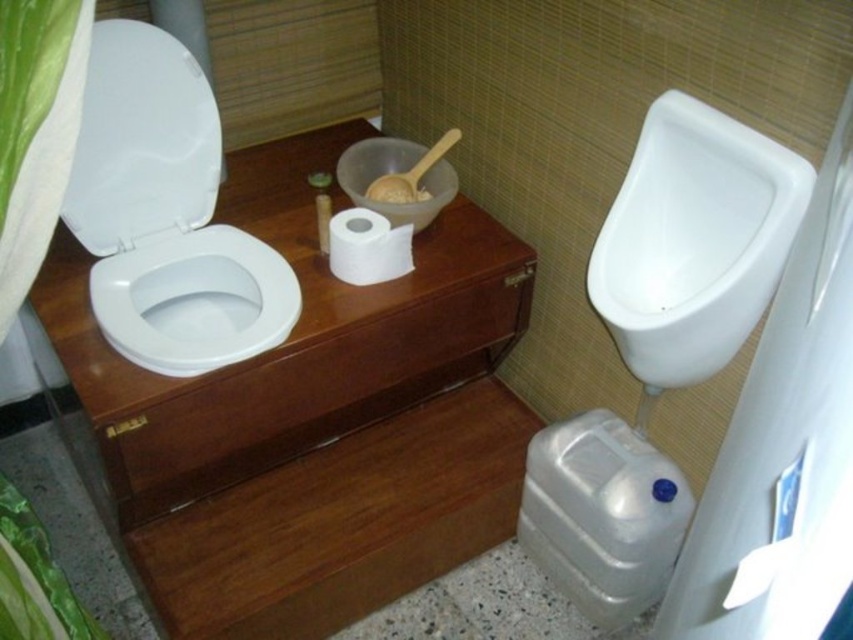
In the scene shown: You are designing a bathroom layout and need to place a decorative plant between the white glossy toilet lid at upper left and the white matte bowl at center. Which object should the plant be closer to if you want it to be equidistant from both objects?

The plant should be closer to the white glossy toilet lid at upper left because it is larger in size than the white matte bowl at center.

You are a maintenance worker in a public restroom. You need to place a tool box between the wooden dresser at center and the wooden drawer at center. The tool box is 3.5 inches wide. Can you fit it between them?

The wooden dresser at center is 3.45 inches away from wooden drawer at center. Since the tool box is 3.5 inches wide, it is slightly wider than the space between them. Therefore, the tool box cannot fit between the wooden dresser at center and the wooden drawer at center.